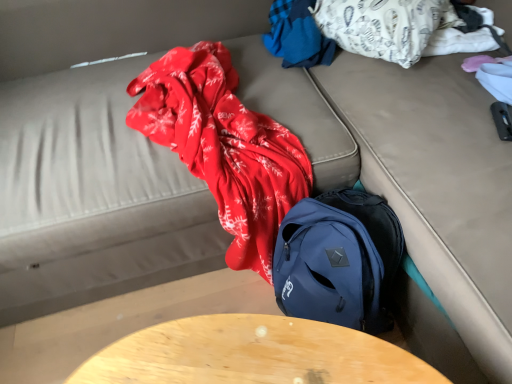
Question: Does white cotton blanket at upper right, which is the 1th clothing in right-to-left order, have a greater width compared to wooden table at center?

Choices:
 (A) yes
 (B) no

Answer: (A)

Question: Is white cotton blanket at upper right, which is the 1th clothing in right-to-left order, smaller than wooden table at center?

Choices:
 (A) yes
 (B) no

Answer: (A)

Question: Does white cotton blanket at upper right, which is the 1th clothing in right-to-left order, appear on the left side of wooden table at center?

Choices:
 (A) no
 (B) yes

Answer: (A)

Question: Is white cotton blanket at upper right, the second clothing when ordered from left to right, at the right side of wooden table at center?

Choices:
 (A) no
 (B) yes

Answer: (B)

Question: Can wooden table at center be found inside white cotton blanket at upper right, which is the 1th clothing in right-to-left order?

Choices:
 (A) no
 (B) yes

Answer: (A)

Question: Considering the relative sizes of white cotton blanket at upper right, which is the 1th clothing in right-to-left order, and wooden table at center in the image provided, is white cotton blanket at upper right, which is the 1th clothing in right-to-left order, shorter than wooden table at center?

Choices:
 (A) no
 (B) yes

Answer: (B)

Question: Can you confirm if blue fabric at upper center, which is the first clothing from left to right, is positioned to the right of wooden table at center?

Choices:
 (A) yes
 (B) no

Answer: (A)

Question: Is blue fabric at upper center, arranged as the 2th clothing when viewed from the right, not within wooden table at center?

Choices:
 (A) no
 (B) yes

Answer: (B)

Question: From a real-world perspective, is blue fabric at upper center, arranged as the 2th clothing when viewed from the right, located higher than wooden table at center?

Choices:
 (A) yes
 (B) no

Answer: (A)

Question: Can you confirm if blue fabric at upper center, arranged as the 2th clothing when viewed from the right, is shorter than wooden table at center?

Choices:
 (A) no
 (B) yes

Answer: (B)

Question: Is wooden table at center surrounded by blue fabric at upper center, arranged as the 2th clothing when viewed from the right?

Choices:
 (A) no
 (B) yes

Answer: (A)

Question: Does blue fabric at upper center, which is the first clothing from left to right, lie in front of wooden table at center?

Choices:
 (A) no
 (B) yes

Answer: (A)

Question: From a real-world perspective, does white cotton blanket at upper right, the second clothing when ordered from left to right, sit lower than blue fabric at upper center, arranged as the 2th clothing when viewed from the right?

Choices:
 (A) no
 (B) yes

Answer: (A)